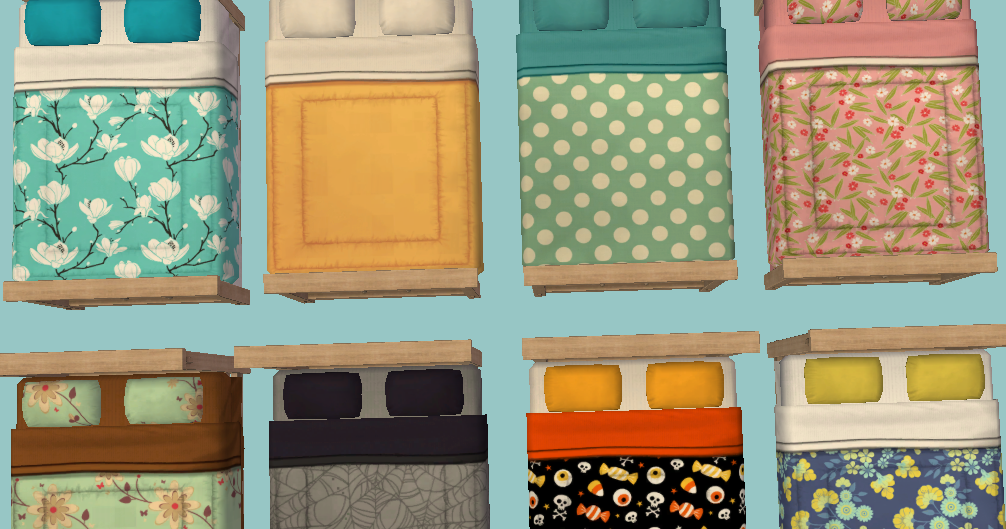
Identify the location of yellow comforter. (x=363, y=165).